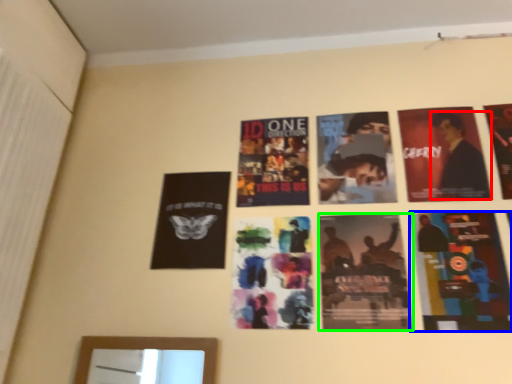
Question: Considering the real-world distances, which object is closest to person (highlighted by a red box)? poster (highlighted by a blue box) or poster (highlighted by a green box).

Choices:
 (A) poster
 (B) poster

Answer: (A)